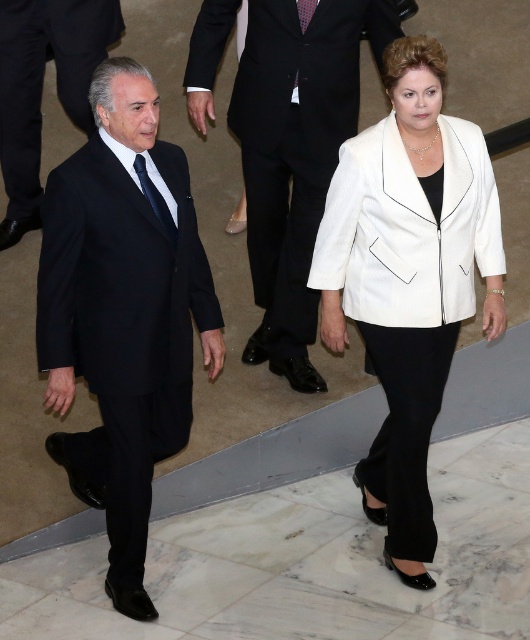
You are standing at the origin of the coordinate system in the image. You see two points, point (163,145) and point (242,96). Which point is closer to you?

Point (163,145) is in front of point (242,96), so it is closer to you.